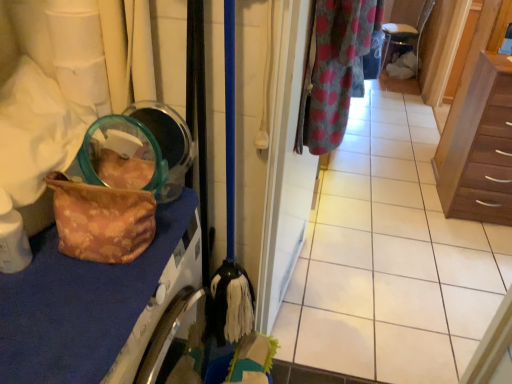
Question: From the image's perspective, would you say gray polka dot fabric at upper right is shown under floral fabric bag at left?

Choices:
 (A) no
 (B) yes

Answer: (A)

Question: Could floral fabric bag at left be considered to be inside gray polka dot fabric at upper right?

Choices:
 (A) yes
 (B) no

Answer: (B)

Question: Considering the relative sizes of gray polka dot fabric at upper right and floral fabric bag at left in the image provided, is gray polka dot fabric at upper right bigger than floral fabric bag at left?

Choices:
 (A) yes
 (B) no

Answer: (A)

Question: Can you confirm if gray polka dot fabric at upper right is wider than floral fabric bag at left?

Choices:
 (A) yes
 (B) no

Answer: (B)

Question: Is gray polka dot fabric at upper right not near floral fabric bag at left?

Choices:
 (A) yes
 (B) no

Answer: (B)

Question: From a real-world perspective, does gray polka dot fabric at upper right sit lower than floral fabric bag at left?

Choices:
 (A) no
 (B) yes

Answer: (A)

Question: Is polka dot fabric door at center smaller than brown wood chest of drawers at right?

Choices:
 (A) no
 (B) yes

Answer: (B)

Question: Is polka dot fabric door at center wider than brown wood chest of drawers at right?

Choices:
 (A) yes
 (B) no

Answer: (B)

Question: Is polka dot fabric door at center to the left of brown wood chest of drawers at right from the viewer's perspective?

Choices:
 (A) yes
 (B) no

Answer: (A)

Question: Is polka dot fabric door at center positioned behind brown wood chest of drawers at right?

Choices:
 (A) yes
 (B) no

Answer: (B)

Question: Does polka dot fabric door at center have a lesser height compared to brown wood chest of drawers at right?

Choices:
 (A) yes
 (B) no

Answer: (B)

Question: Is polka dot fabric door at center positioned with its back to brown wood chest of drawers at right?

Choices:
 (A) no
 (B) yes

Answer: (A)

Question: Is gray polka dot fabric at upper right not within polka dot fabric door at center?

Choices:
 (A) no
 (B) yes

Answer: (B)